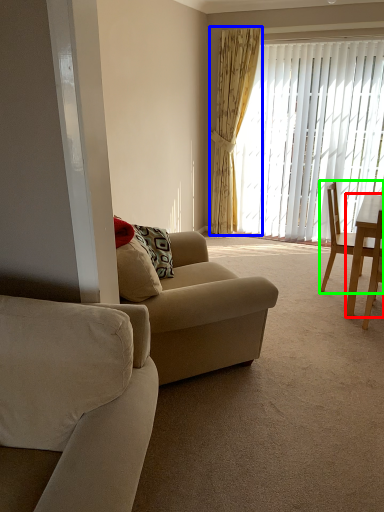
Question: Considering the real-world distances, which object is farthest from desk (highlighted by a red box)? curtain (highlighted by a blue box) or chair (highlighted by a green box)?

Choices:
 (A) curtain
 (B) chair

Answer: (A)